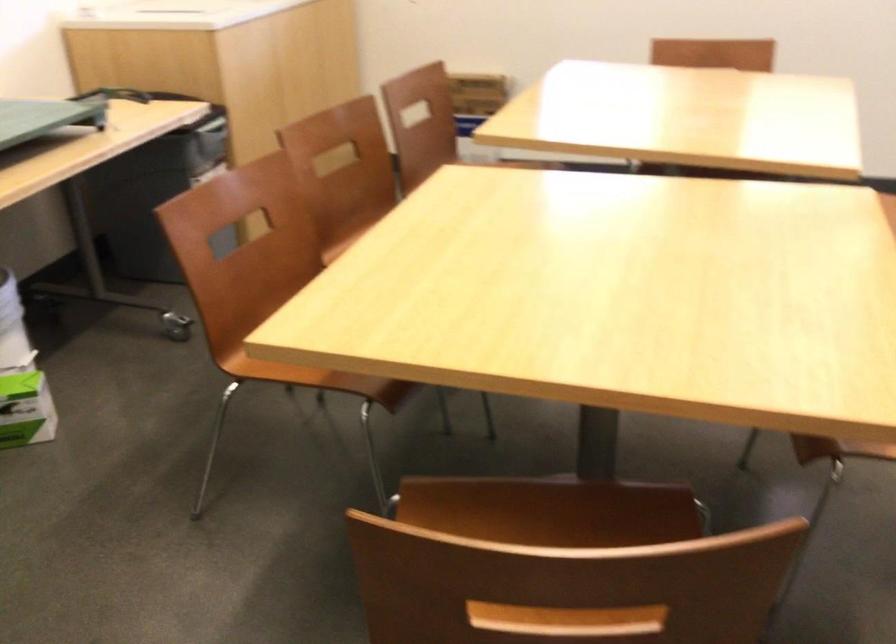
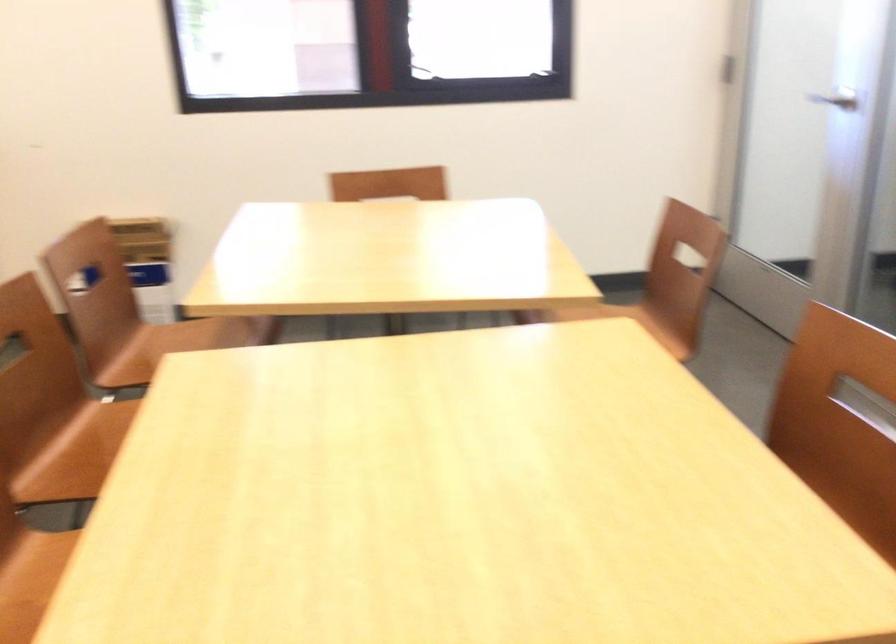
Question: The camera is either moving clockwise (left) or counter-clockwise (right) around the object. The first image is from the beginning of the video and the second image is from the end. Is the camera moving left or right when shooting the video?

Choices:
 (A) Left
 (B) Right

Answer: (A)